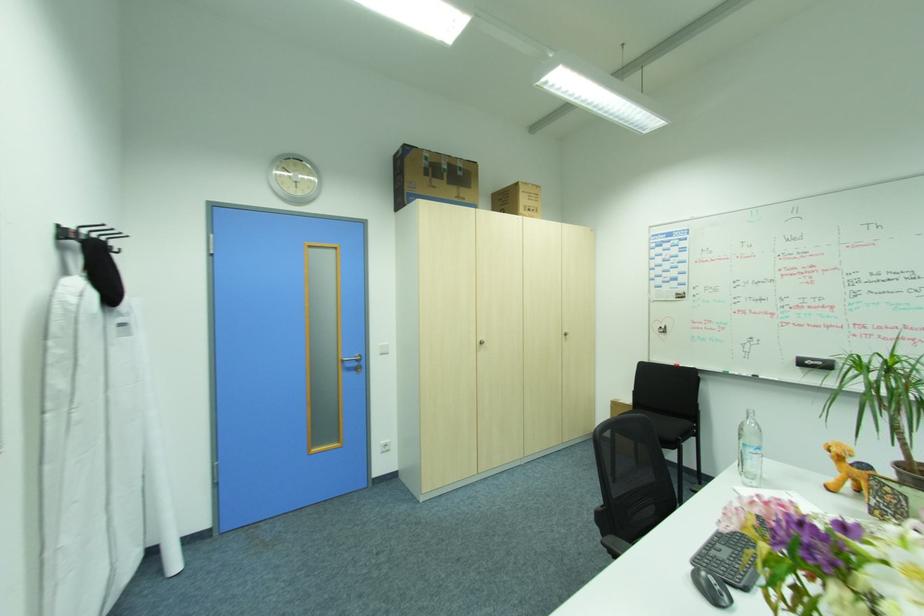
Which object does [846,469] point to?

This point indicates the stuffed animal toy.